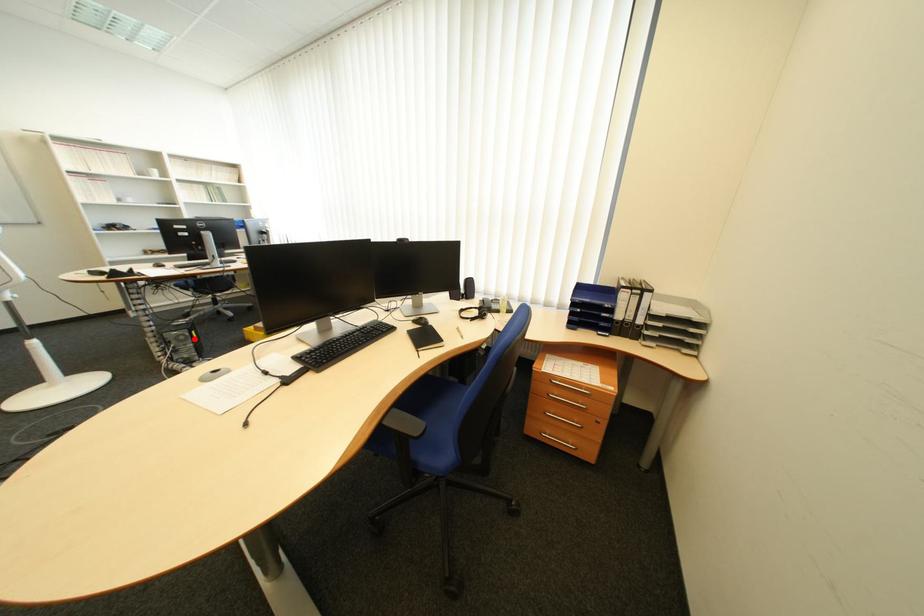
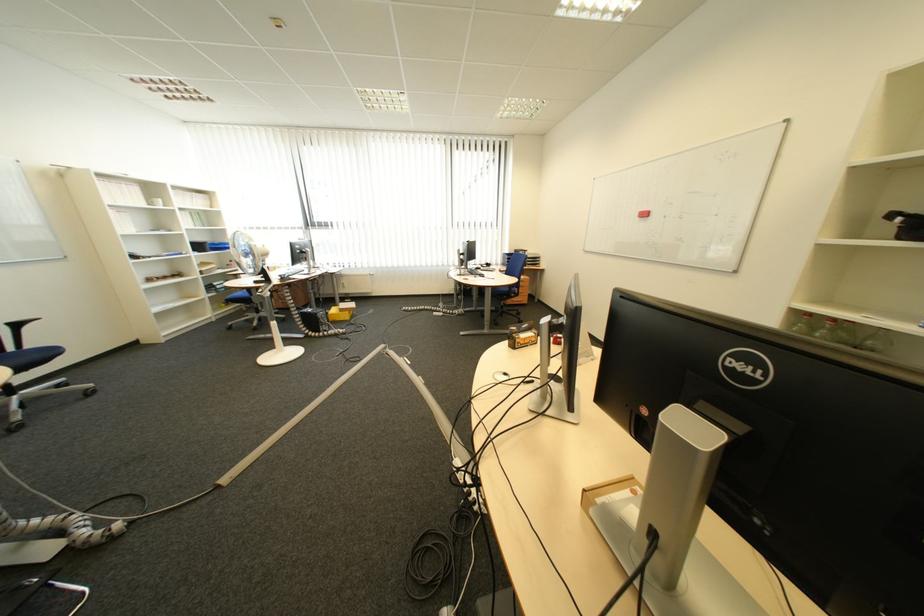
In the second image, find the point that corresponds to the highlighted location in the first image.

(335, 317)